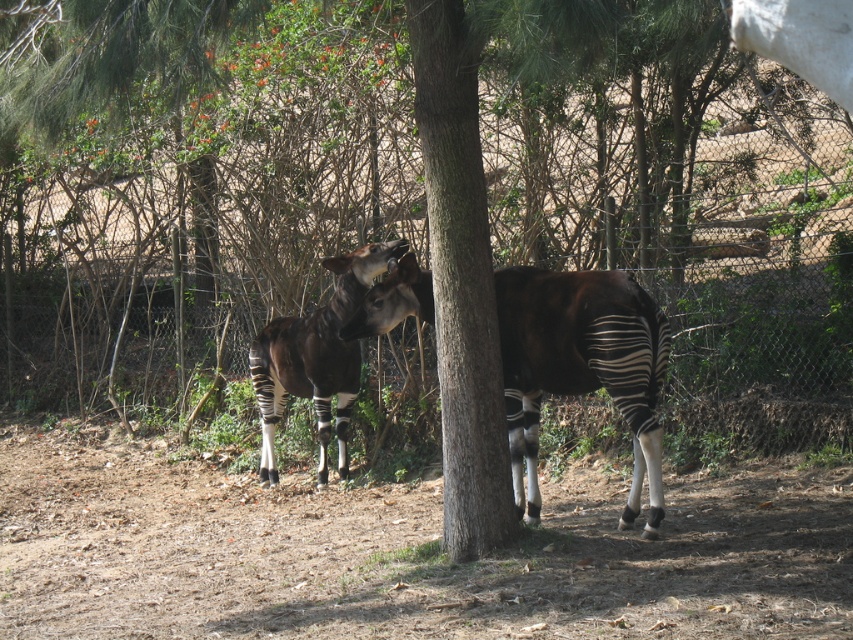
You are a zookeeper observing the okapi enclosure. You notice the brown rough tree trunk at center and the black and white striped okapi at center. Which object is positioned closer to you?

The brown rough tree trunk at center is closer to the viewer than the black and white striped okapi at center.

Based on the photo, you are a zookeeper observing the okapi in their enclosure. You notice the brown rough tree trunk at center and the black and white striped okapi at center. Which object is closer to you?

The brown rough tree trunk at center is closer to you because it is positioned over the black and white striped okapi at center, indicating it is in front of the okapi.